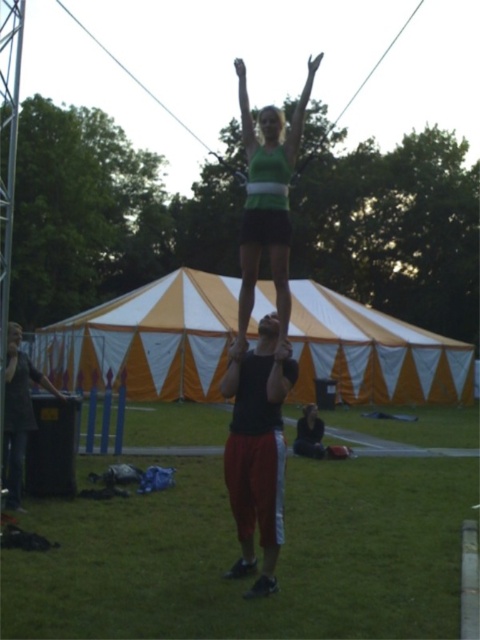
Who is more forward, [272,493] or [268,112]?

Positioned in front is point [272,493].

This screenshot has height=640, width=480. What do you see at coordinates (257, 449) in the screenshot?
I see `black cotton t-shirt at center` at bounding box center [257, 449].

This screenshot has height=640, width=480. I want to click on black cotton t-shirt at center, so click(257, 449).

This screenshot has width=480, height=640. Find the location of `black cotton t-shirt at center`. black cotton t-shirt at center is located at coordinates (257, 449).

The height and width of the screenshot is (640, 480). Describe the element at coordinates (148, 339) in the screenshot. I see `yellow/white striped tent at center` at that location.

In the scene shown: Does yellow/white striped tent at center appear over blonde hair at upper center?

Incorrect, yellow/white striped tent at center is not positioned above blonde hair at upper center.

Where is `yellow/white striped tent at center`? The width and height of the screenshot is (480, 640). yellow/white striped tent at center is located at coordinates (148, 339).

Does dark gray fabric jacket at lower left have a larger size compared to smooth skin head at center?

Actually, dark gray fabric jacket at lower left might be smaller than smooth skin head at center.

Who is shorter, dark gray fabric jacket at lower left or smooth skin head at center?

With less height is dark gray fabric jacket at lower left.

Is point (11, 371) less distant than point (277, 115)?

No, it is behind (277, 115).

Find the location of a particular element. dark gray fabric jacket at lower left is located at coordinates (19, 412).